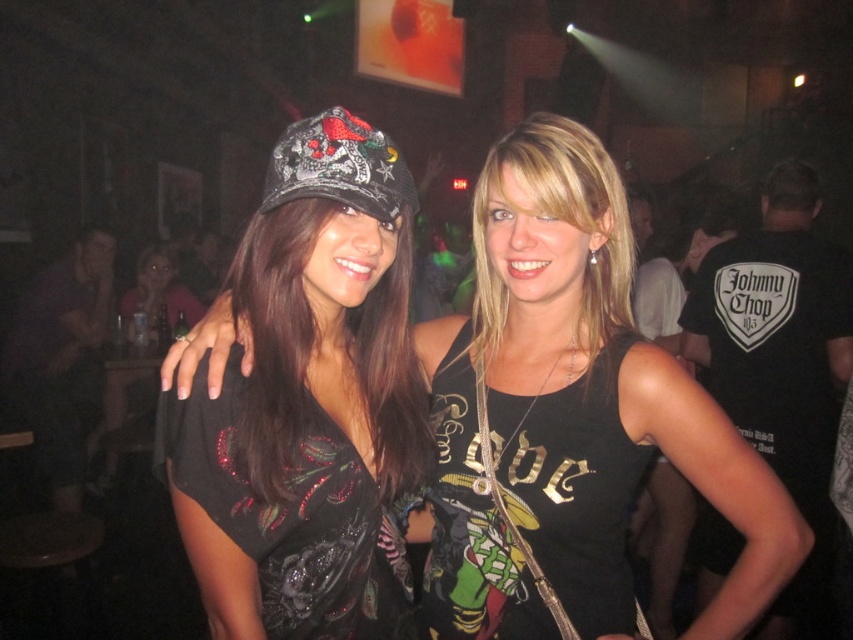
You are a photographer trying to capture the reflection of the shiny sequined top at center and the black matte tank top at center in a mirror placed behind them. Which top will have a more visible reflection?

The shiny sequined top at center will have a more visible reflection because it is positioned over the black matte tank top at center and its reflective surface would cast a stronger image in the mirror.

You are a photographer standing at the camera position. You want to take a photo of the two people in the image. The focus point of your camera is set to point [618,570]. Is this point within the recommended focus range of 3.5 to 4.5 feet for optimal sharpness?

The distance between point [618,570] and the camera is 3.96 feet, which falls within the recommended focus range of 3.5 to 4.5 feet. Therefore, the focus point is optimal for sharpness.

You are a photographer trying to decide which clothing item to focus on for a closeup shot. The black matte tank top at center and the black sequined dress at center are both in the center of the frame. Which one has a narrower width?

The black matte tank top at center is thinner than the black sequined dress at center, so the black matte tank top at center has a narrower width.